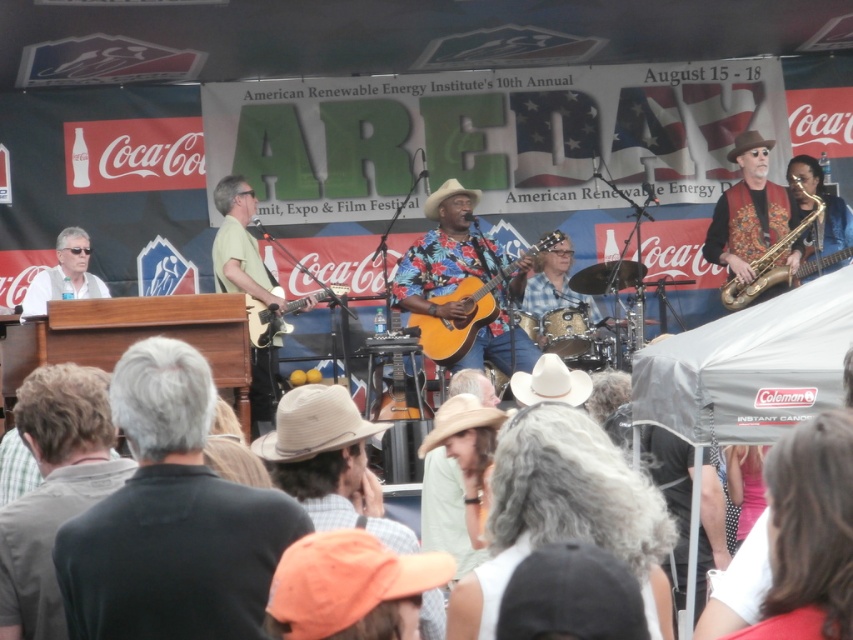
You are a photographer at the festival and need to capture a closeup of the gray hair at center and the brown felt cowboy hat at upper right. Given that your camera lens can only focus on objects wider than 10 cm, will both objects be in focus?

The gray hair at center is wider than the brown felt cowboy hat at upper right. Since the gray hair at center is wider than 10 cm, it will be in focus. However, the brown felt cowboy hat at upper right may be narrower than 10 cm and might not be in focus.

Based on the scene description, if you were standing in front of the stage, which object would you see first when looking from left to right? The white straw cowboy hat at center or the matte black guitar at center?

The matte black guitar at center is to the left of the white straw cowboy hat at center, so you would see the matte black guitar at center first when looking from left to right.